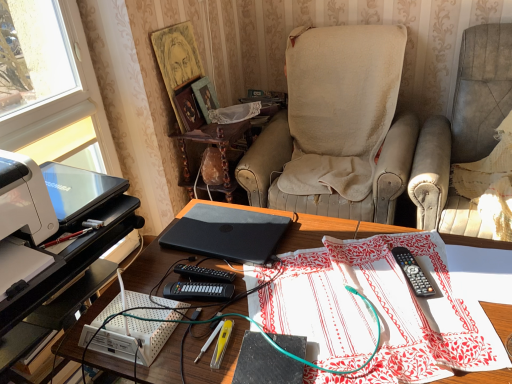
Identify the location of free space behind black plastic keyboard at center, acting as the 2th stationery starting from the right. (194, 260).